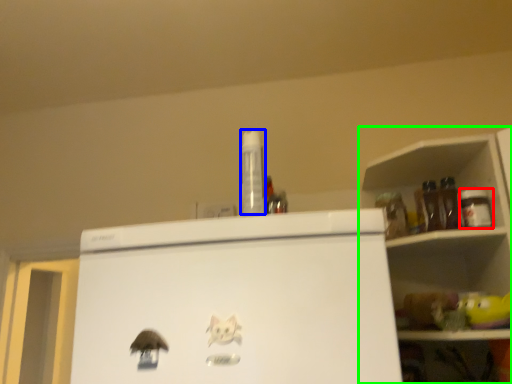
Question: Which object is positioned farthest from bottle (highlighted by a red box)? Select from bottle (highlighted by a blue box) and shelf (highlighted by a green box).

Choices:
 (A) bottle
 (B) shelf

Answer: (A)